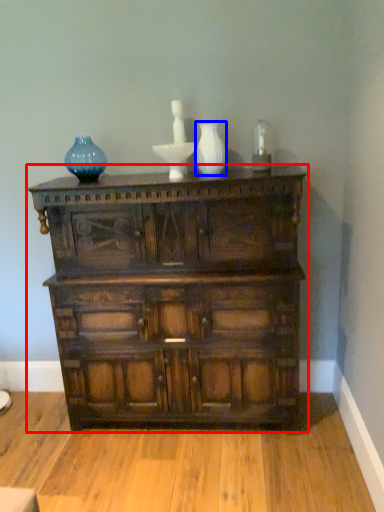
Question: Which object is closer to the camera taking this photo, chest of drawers (highlighted by a red box) or glass vase (highlighted by a blue box)?

Choices:
 (A) chest of drawers
 (B) glass vase

Answer: (A)